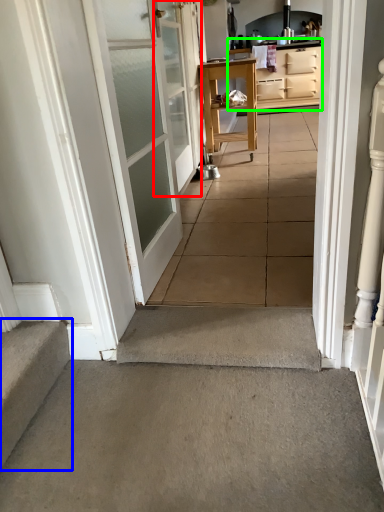
Question: Which object is the closest to the door (highlighted by a red box)? Choose among these: stairs (highlighted by a blue box) or cabinetry (highlighted by a green box).

Choices:
 (A) stairs
 (B) cabinetry

Answer: (A)